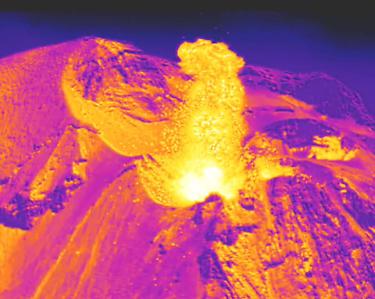
The width and height of the screenshot is (375, 299). Identify the location of corners. (374, 295), (373, 0), (4, 0), (3, 298).